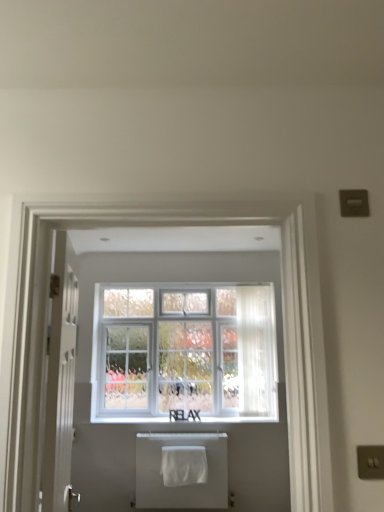
Question: Which is correct: white matte window sill at center is inside white fabric bath towel at lower center, which ranks as the first bath towel in front-to-back order, or outside of it?

Choices:
 (A) inside
 (B) outside

Answer: (B)

Question: Considering the positions of point (243, 420) and point (165, 445), is point (243, 420) closer or farther from the camera than point (165, 445)?

Choices:
 (A) closer
 (B) farther

Answer: (B)

Question: Estimate the real-world distances between objects in this image. Which object is farther from the white cotton bath towel at lower center, which is counted as the first bath towel, starting from the back?

Choices:
 (A) white textured window at center
 (B) white matte window sill at center
 (C) white fabric bath towel at lower center, which is the second bath towel in back-to-front order
 (D) white glossy door at left
 (E) satin gold switch at lower right

Answer: (E)

Question: Based on their relative distances, which object is nearer to the white cotton bath towel at lower center, the 2th bath towel in the front-to-back sequence?

Choices:
 (A) white matte window sill at center
 (B) white glossy door at left
 (C) white textured window at center
 (D) white fabric bath towel at lower center, which ranks as the first bath towel in front-to-back order
 (E) satin gold switch at lower right

Answer: (D)